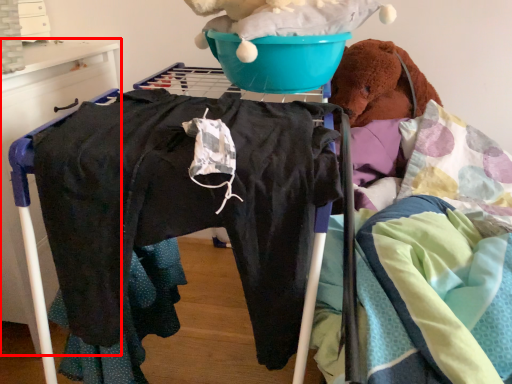
Question: Where is furniture (annotated by the red box) located in relation to basin in the image?

Choices:
 (A) right
 (B) left

Answer: (B)